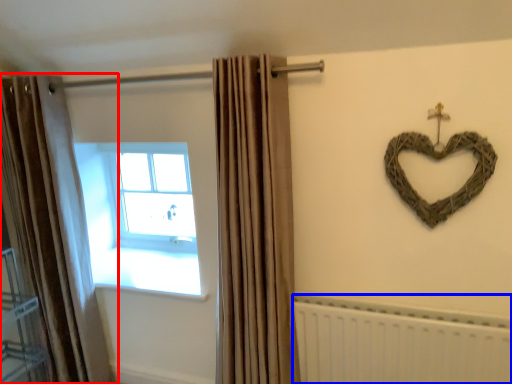
Question: Which object appears farthest to the camera in this image, curtain (highlighted by a red box) or radiator (highlighted by a blue box)?

Choices:
 (A) curtain
 (B) radiator

Answer: (A)